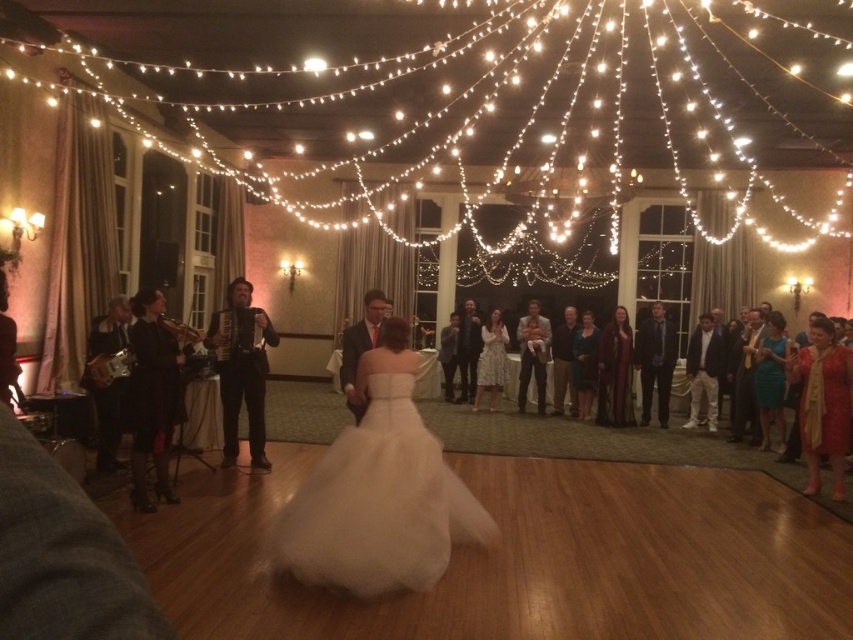
Who is lower down, black leather accordion at left or shiny red dress at right?

shiny red dress at right is lower down.

Which is more to the left, black leather accordion at left or shiny red dress at right?

black leather accordion at left

The width and height of the screenshot is (853, 640). I want to click on black leather accordion at left, so click(155, 394).

Does dark gray suit at center appear under white lace dress at center?

Yes, dark gray suit at center is below white lace dress at center.

Find the location of a particular element. dark gray suit at center is located at coordinates (654, 362).

Can you confirm if white tulle dress at center is positioned to the right of white lace dress at center?

In fact, white tulle dress at center is to the left of white lace dress at center.

Is white tulle dress at center closer to camera compared to white lace dress at center?

Yes, it is.

At what (x,y) coordinates should I click in order to perform the action: click on white tulle dress at center. Please return your answer as a coordinate pair (x, y). Looking at the image, I should click on (379, 502).

The image size is (853, 640). I want to click on white tulle dress at center, so point(379,502).